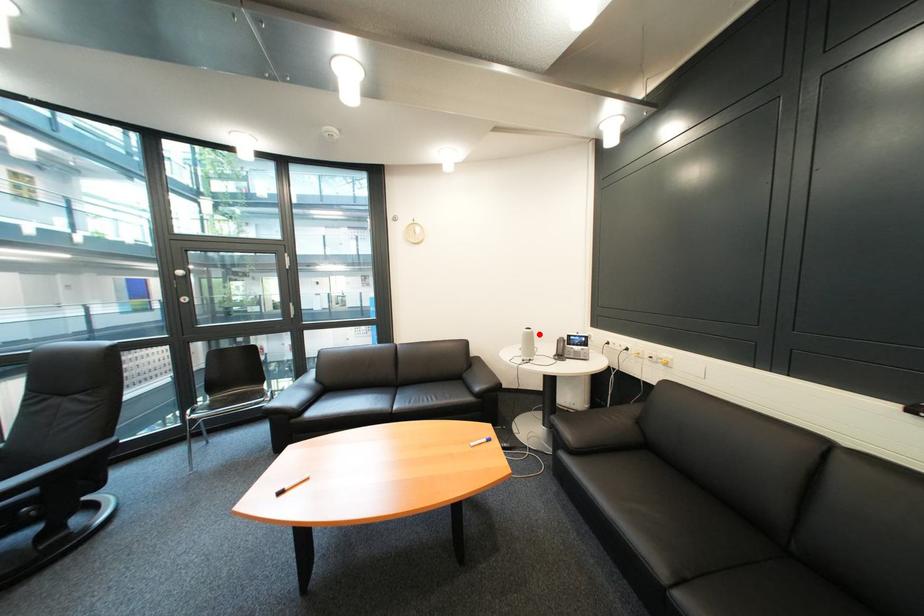
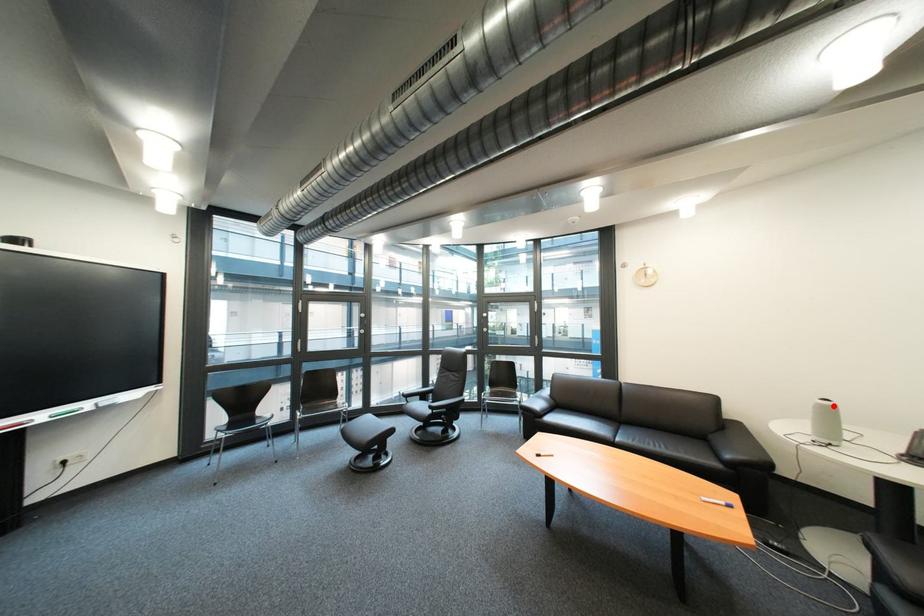
I am providing you with two images of the same scene from different viewpoints. A red point is marked on the first image and another point is marked on the second image. Do the highlighted points in image1 and image2 indicate the same real-world spot?

Yes